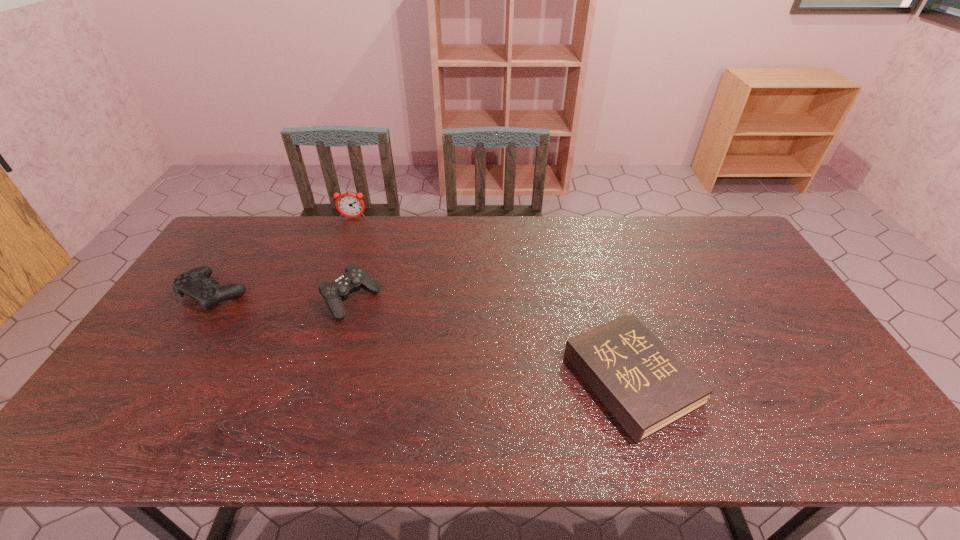
Where is `free space between the shortest object and the right control`? Image resolution: width=960 pixels, height=540 pixels. free space between the shortest object and the right control is located at coordinates (492, 340).

You are a GUI agent. You are given a task and a screenshot of the screen. Output one action in this format:
    pyautogui.click(x=<x>, y=<y>)
    Task: Click on the free space between the rightmost object and the alarm clock
    
    Given the screenshot: What is the action you would take?
    pyautogui.click(x=492, y=299)

Identify the location of free space that is in between the left control and the farthest object. The height and width of the screenshot is (540, 960). (284, 255).

You are a GUI agent. You are given a task and a screenshot of the screen. Output one action in this format:
    pyautogui.click(x=<x>, y=<y>)
    Task: Click on the free area in between the left control and the alarm clock
    The image size is (960, 540).
    Given the screenshot: What is the action you would take?
    pyautogui.click(x=284, y=255)

Where is `free space that is in between the hardback book and the tallest object`? free space that is in between the hardback book and the tallest object is located at coordinates (492, 299).

Where is `free space between the hardback book and the alarm clock`? This screenshot has height=540, width=960. free space between the hardback book and the alarm clock is located at coordinates (492, 299).

The height and width of the screenshot is (540, 960). What are the coordinates of `empty location between the rightmost object and the leftmost object` in the screenshot? It's located at (423, 336).

Identify the location of the second closest object to the left control. (350, 205).

Locate which object ranks in proximity to the left control. Please provide its 2D coordinates. Your answer should be formatted as a tuple, i.e. [(x, y)], where the tuple contains the x and y coordinates of a point satisfying the conditions above.

[(355, 277)]

Locate an element on the screen. The width and height of the screenshot is (960, 540). vacant space that satisfies the following two spatial constraints: 1. on the front-facing side of the hardback book; 2. on the right side of the farthest object is located at coordinates (293, 379).